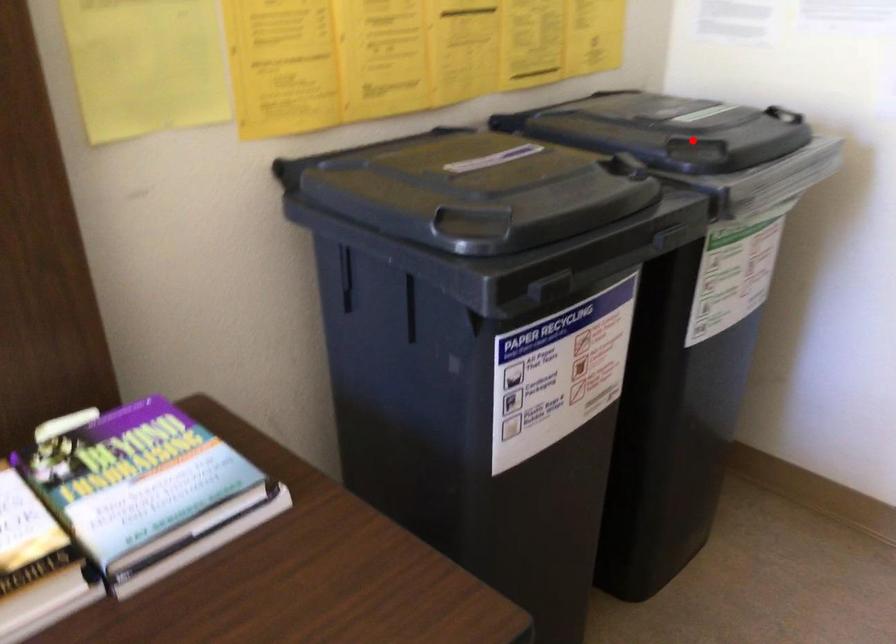
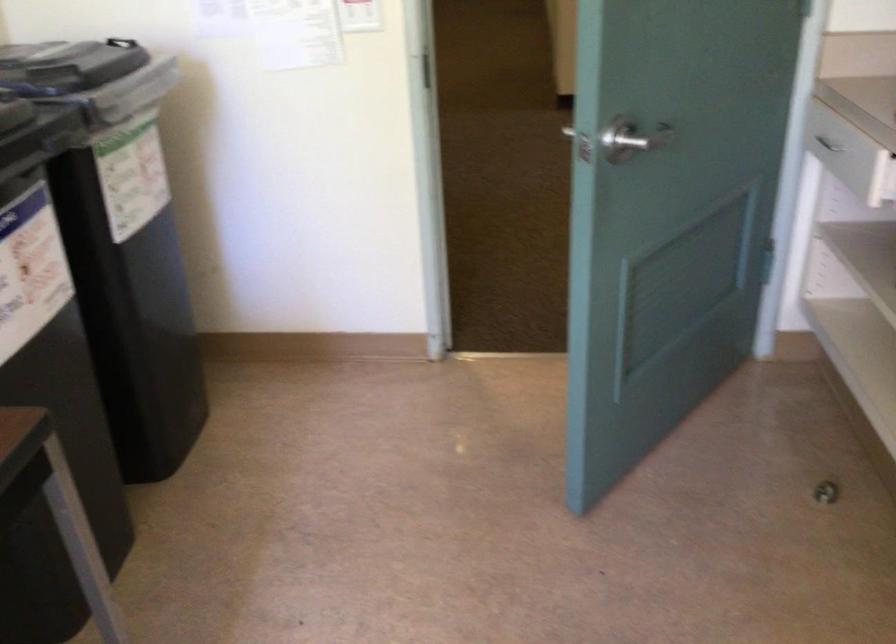
The point at the highlighted location is marked in the first image. Where is the corresponding point in the second image?

(66, 64)